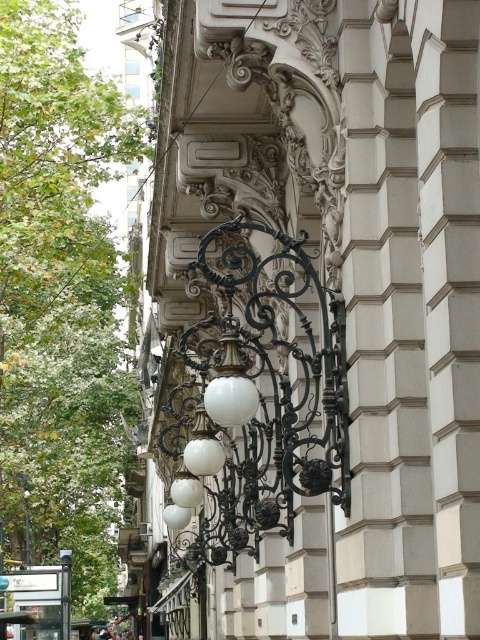
Is white matte lamp at center to the right of white matte lamp post at lower left from the viewer's perspective?

Correct, you'll find white matte lamp at center to the right of white matte lamp post at lower left.

Can you confirm if white matte lamp at center is wider than white matte lamp post at lower left?

Correct, the width of white matte lamp at center exceeds that of white matte lamp post at lower left.

Identify the location of white matte lamp at center. (256, 394).

Based on the photo, between white matte lamp post at lower left and white matte lamp post at center, which one has more height?

white matte lamp post at center is taller.

Who is higher up, white matte lamp post at lower left or white matte lamp post at center?

Positioned higher is white matte lamp post at center.

The image size is (480, 640). I want to click on white matte lamp post at lower left, so click(66, 593).

Where is `white matte lamp post at lower left`? white matte lamp post at lower left is located at coordinates (66, 593).

Image resolution: width=480 pixels, height=640 pixels. Identify the location of white matte lamp at center. (256, 394).

Is point (287, 365) farther from viewer compared to point (24, 529)?

No, it is in front of (24, 529).

Does point (171, 515) come behind point (26, 548)?

No.

Where is `white matte lamp at center`? Image resolution: width=480 pixels, height=640 pixels. white matte lamp at center is located at coordinates (256, 394).